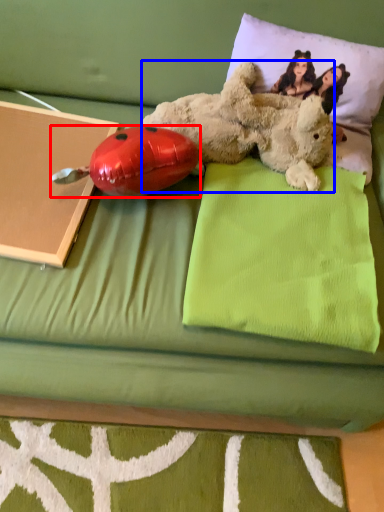
Question: Which of the following is the closest to the observer, ladybug (highlighted by a red box) or teddy bear (highlighted by a blue box)?

Choices:
 (A) ladybug
 (B) teddy bear

Answer: (A)